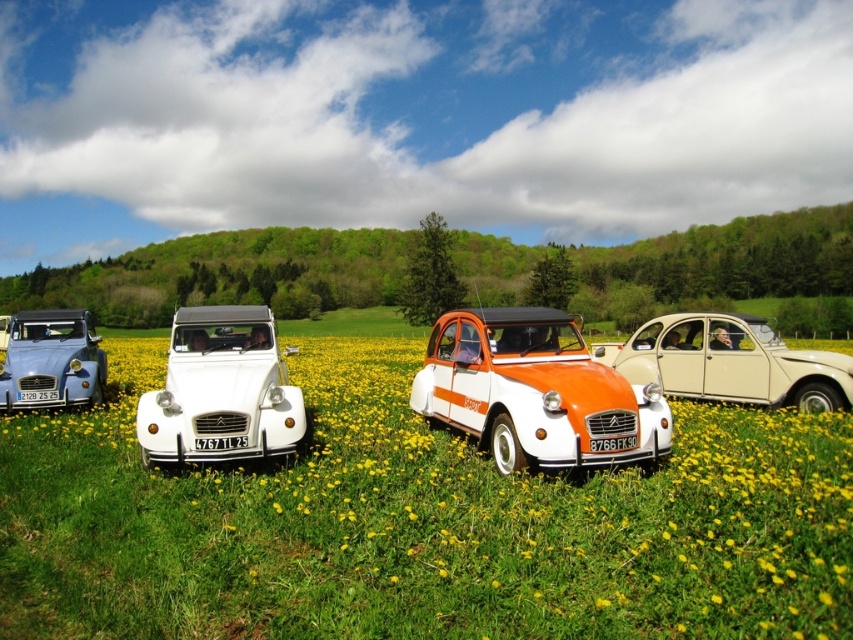
You are a photographer planning to capture a photo of the orange matte car at center and the matte blue car at left. Since you want to ensure both cars are fully visible in the frame, which car requires you to adjust your camera angle to account for its height?

The orange matte car at center is much taller than the matte blue car at left, so you need to adjust the camera angle to accommodate its height to ensure it fits within the frame.